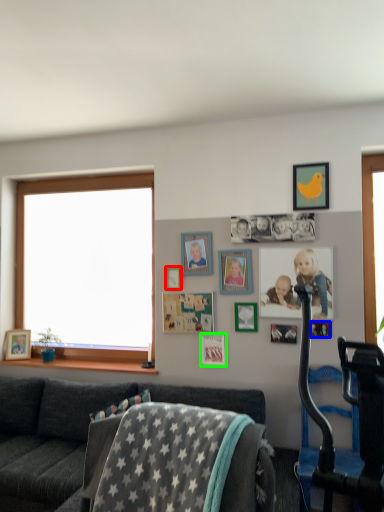
Question: Estimate the real-world distances between objects in this image. Which object is closer to picture frame (highlighted by a red box), picture frame (highlighted by a blue box) or picture frame (highlighted by a green box)?

Choices:
 (A) picture frame
 (B) picture frame

Answer: (B)